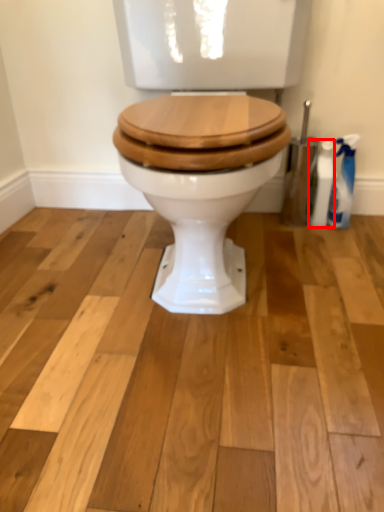
Question: In this image, where is cleaning product (annotated by the red box) located relative to cleaning product?

Choices:
 (A) right
 (B) left

Answer: (B)